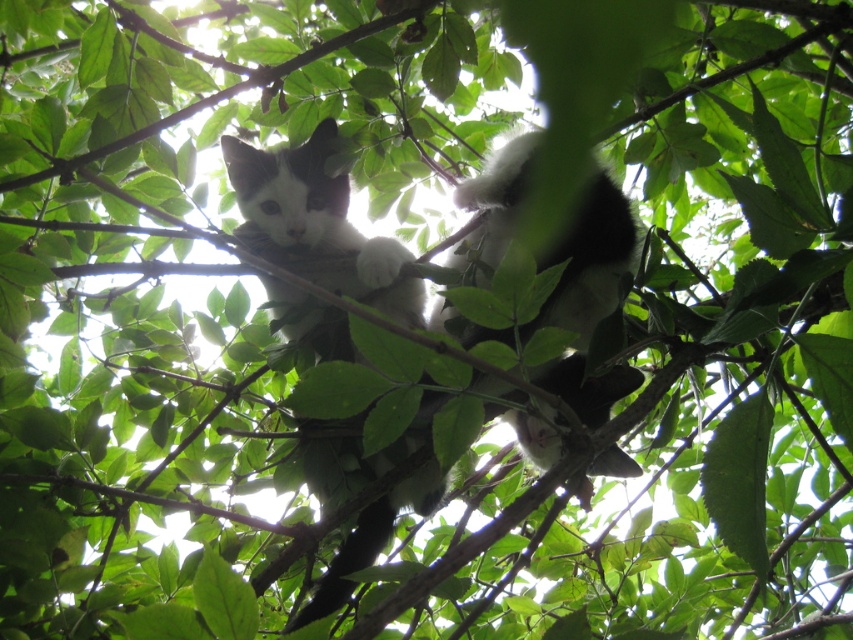
Question: Is black and white fur cat at center thinner than white fluffy cat at center?

Choices:
 (A) yes
 (B) no

Answer: (B)

Question: Can you confirm if black and white fur cat at center is positioned to the right of white fluffy cat at center?

Choices:
 (A) no
 (B) yes

Answer: (B)

Question: Which of the following is the closest to the observer?

Choices:
 (A) (264, 188)
 (B) (442, 312)

Answer: (B)

Question: Does black and white fur cat at center have a lesser width compared to white fluffy cat at center?

Choices:
 (A) no
 (B) yes

Answer: (A)